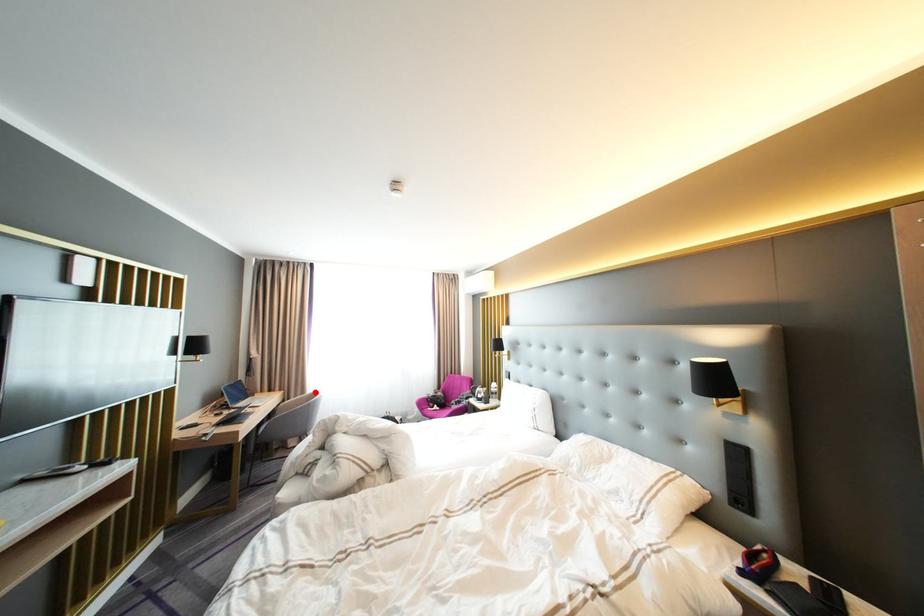
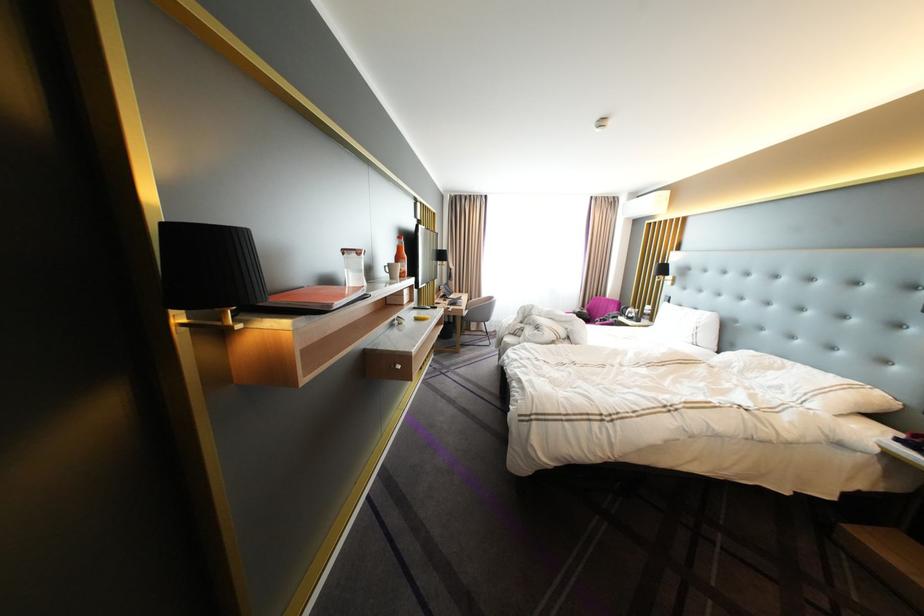
Locate, in the second image, the point that corresponds to the highlighted location in the first image.

(492, 296)